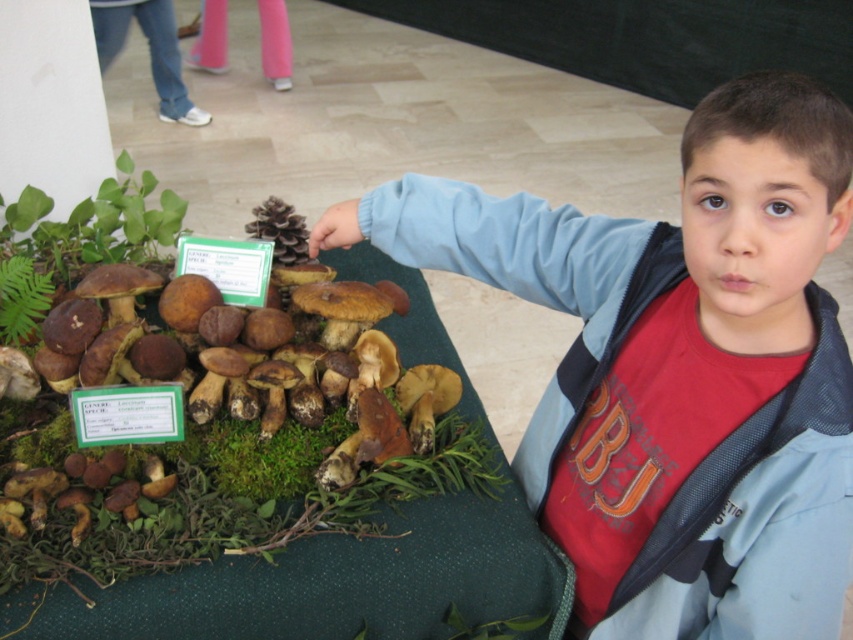
Describe the element at coordinates (264, 454) in the screenshot. I see `green moss at center` at that location.

Who is positioned more to the right, green moss at center or green moss at lower left?

green moss at lower left is more to the right.

Is point (248, 497) closer to camera compared to point (509, 624)?

No, (248, 497) is behind (509, 624).

Locate an element on the screen. The height and width of the screenshot is (640, 853). green moss at center is located at coordinates (264, 454).

Is matte brown mushroom at upper left smaller than green leafy plant at upper left?

Actually, matte brown mushroom at upper left might be larger than green leafy plant at upper left.

Who is positioned more to the left, matte brown mushroom at upper left or green leafy plant at upper left?

green leafy plant at upper left

Is point (685, 342) positioned behind point (112, 188)?

No, it is not.

The image size is (853, 640). I want to click on matte brown mushroom at upper left, so click(677, 369).

Does matte brown mushroom at upper left have a greater height compared to green moss at lower left?

Indeed, matte brown mushroom at upper left has a greater height compared to green moss at lower left.

Between matte brown mushroom at upper left and green moss at lower left, which one has more height?

Standing taller between the two is matte brown mushroom at upper left.

Locate an element on the screen. The height and width of the screenshot is (640, 853). matte brown mushroom at upper left is located at coordinates pos(677,369).